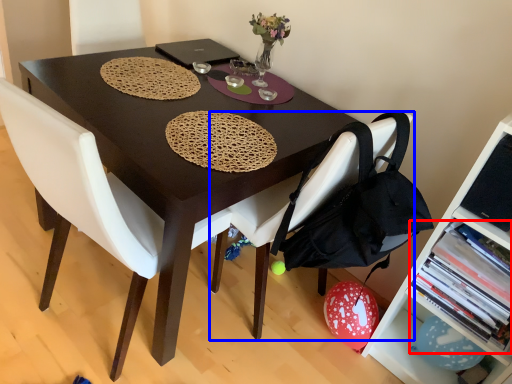
Question: Among these objects, which one is nearest to the camera, book (highlighted by a red box) or chair (highlighted by a blue box)?

Choices:
 (A) book
 (B) chair

Answer: (B)